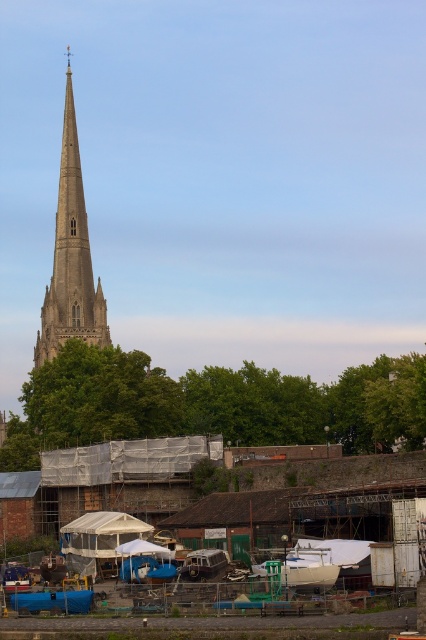
Does smooth stone spire at left have a lesser width compared to white matte boat at center?

Incorrect, smooth stone spire at left's width is not less than white matte boat at center's.

Can you confirm if smooth stone spire at left is positioned to the right of white matte boat at center?

Incorrect, smooth stone spire at left is not on the right side of white matte boat at center.

Which is behind, point (72, 307) or point (336, 576)?

The point (72, 307) is behind.

Locate an element on the screen. smooth stone spire at left is located at coordinates (71, 257).